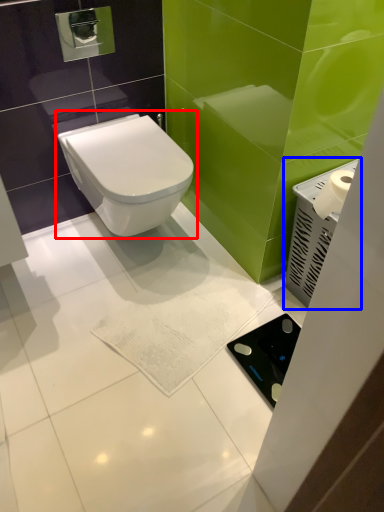
Question: Which point is closer to the camera, toilet (highlighted by a red box) or appliance (highlighted by a blue box)?

Choices:
 (A) toilet
 (B) appliance

Answer: (B)